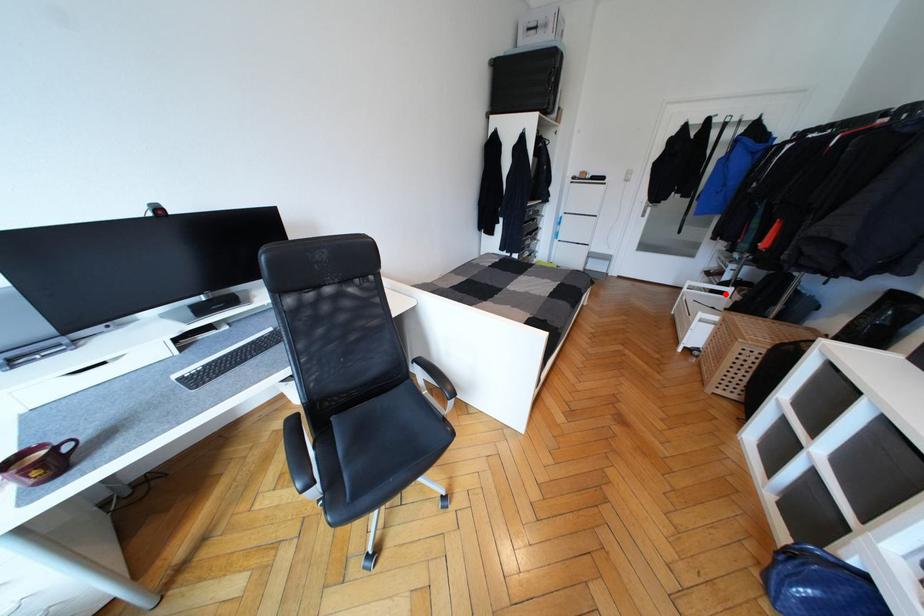
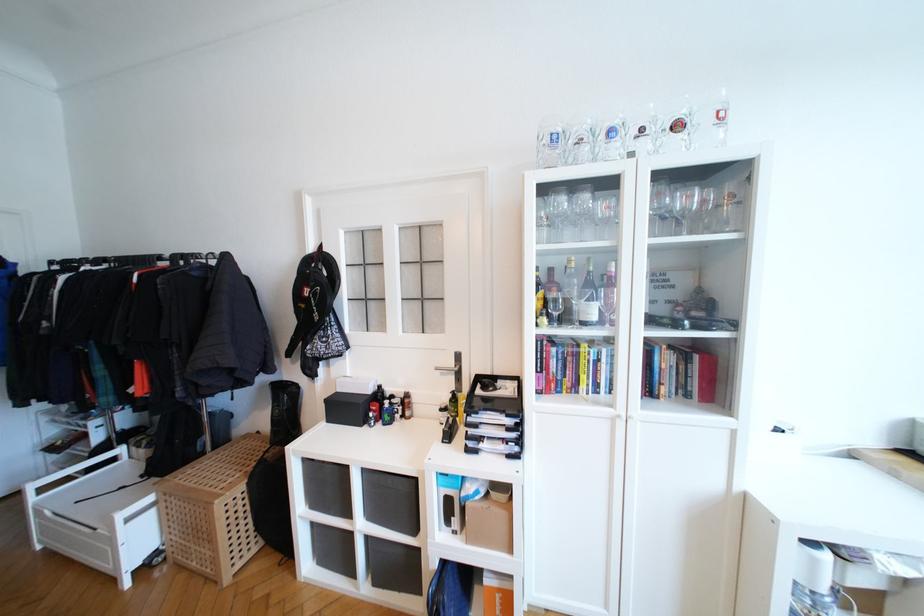
Find the pixel in the second image that matches the highlighted location in the first image.

(116, 461)